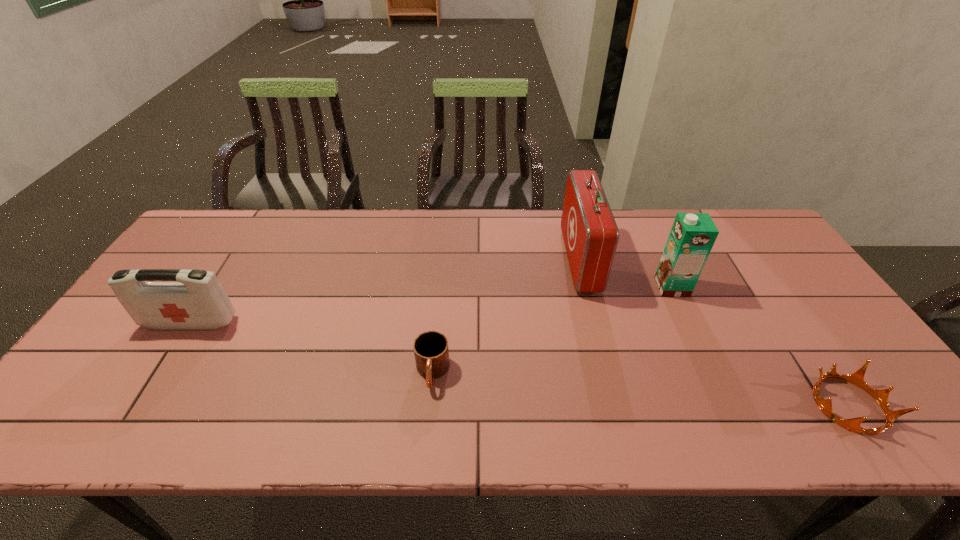
In order to click on the right first-aid kit in this screenshot , I will do `click(590, 233)`.

Locate an element on the screen. The height and width of the screenshot is (540, 960). the third object from left to right is located at coordinates (590, 233).

The width and height of the screenshot is (960, 540). Find the location of `the fourth object from left to right`. the fourth object from left to right is located at coordinates (692, 236).

Find the location of a particular element. This screenshot has height=540, width=960. the left first-aid kit is located at coordinates (198, 301).

Locate an element on the screen. The image size is (960, 540). the nearer first-aid kit is located at coordinates (198, 301).

Identify the location of the fourth object from right to left. (431, 351).

In order to click on crown in this screenshot , I will do `click(857, 378)`.

The height and width of the screenshot is (540, 960). What are the coordinates of `free space located on the side of the right first-aid kit with the first aid cross symbol` in the screenshot? It's located at (540, 260).

The width and height of the screenshot is (960, 540). I want to click on vacant space located 0.380m on the side of the right first-aid kit with the first aid cross symbol, so click(x=444, y=260).

This screenshot has height=540, width=960. I want to click on vacant point located on the side of the right first-aid kit with the first aid cross symbol, so click(521, 260).